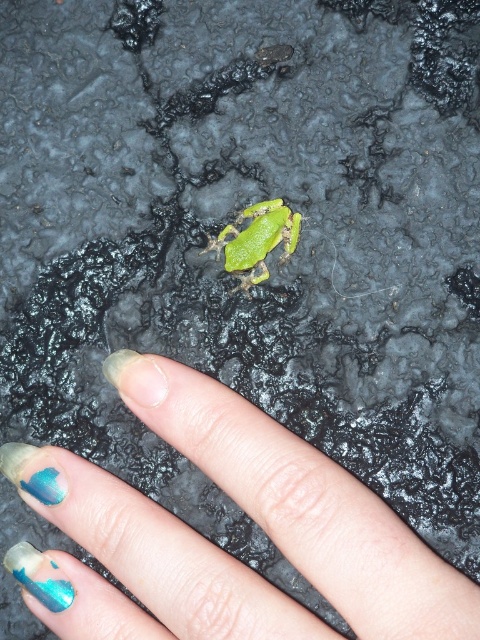
Question: Does teal painted nails at lower left appear on the right side of green matte/frosted frog at center?

Choices:
 (A) no
 (B) yes

Answer: (A)

Question: Which object is closer to the camera taking this photo?

Choices:
 (A) teal painted nails at lower left
 (B) green matte/frosted frog at center

Answer: (A)

Question: Is teal painted nails at lower left to the left of green matte/frosted frog at center from the viewer's perspective?

Choices:
 (A) no
 (B) yes

Answer: (B)

Question: Observing the image, what is the correct spatial positioning of teal painted nails at lower left in reference to green matte/frosted frog at center?

Choices:
 (A) right
 (B) left

Answer: (B)

Question: Which point is farther to the camera?

Choices:
 (A) (236, 266)
 (B) (132, 618)

Answer: (A)

Question: Which of the following is the closest to the observer?

Choices:
 (A) teal painted nails at lower left
 (B) green matte/frosted frog at center

Answer: (A)